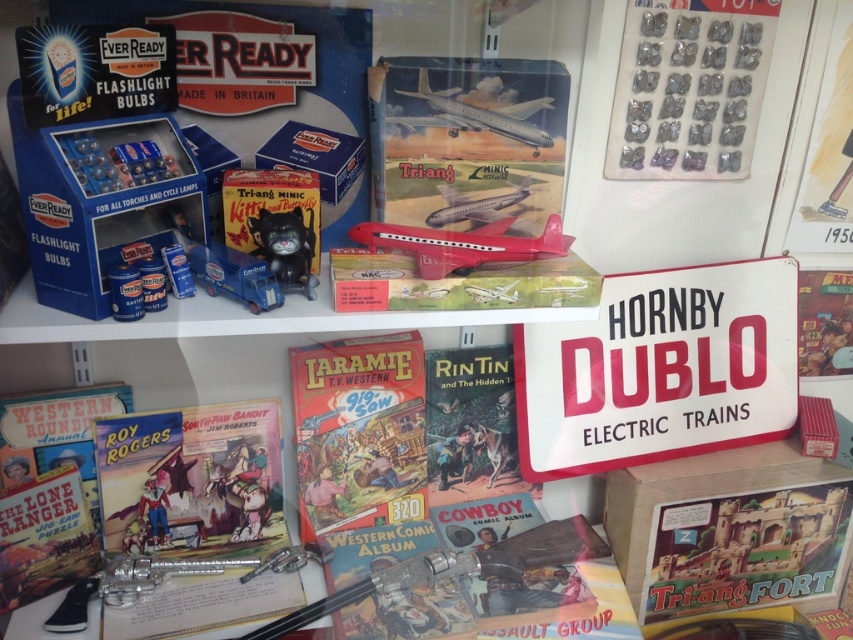
Question: Considering the relative positions of hardcover comic book at center and metallic airplane at upper center in the image provided, where is hardcover comic book at center located with respect to metallic airplane at upper center?

Choices:
 (A) right
 (B) left

Answer: (B)

Question: Which object appears closest to the camera in this image?

Choices:
 (A) metallic silver airplane at center
 (B) blue metallic truck at center
 (C) matte red airplane at center
 (D) matte cardboard comic book at center

Answer: (B)

Question: In this image, where is matte cardboard comic book at center located relative to metallic airplane at upper center?

Choices:
 (A) below
 (B) above

Answer: (A)

Question: Among these points, which one is nearest to the camera?

Choices:
 (A) (463, 234)
 (B) (515, 291)
 (C) (650, 360)
 (D) (341, 474)

Answer: (B)

Question: Which of these objects is positioned farthest from the metallic airplane at upper center?

Choices:
 (A) white paper comic book at center
 (B) matte black cat at center
 (C) hardcover comic book at center

Answer: (C)

Question: Is the position of white paper comic book at center less distant than that of matte red airplane at center?

Choices:
 (A) yes
 (B) no

Answer: (B)